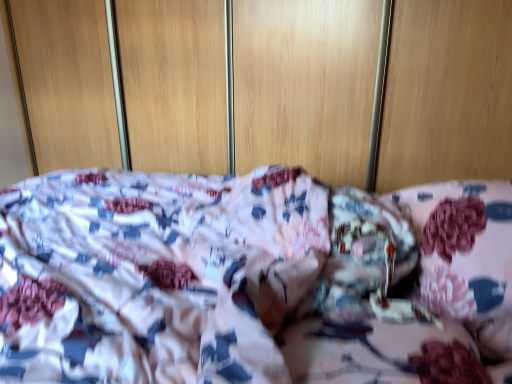
Question: Is wooden dresser at center bigger than fluffy pink pillow at right?

Choices:
 (A) yes
 (B) no

Answer: (A)

Question: Is fluffy pink pillow at right completely or partially inside wooden dresser at center?

Choices:
 (A) yes
 (B) no

Answer: (B)

Question: Does wooden dresser at center have a lesser width compared to fluffy pink pillow at right?

Choices:
 (A) yes
 (B) no

Answer: (A)

Question: Is wooden dresser at center closer to camera compared to fluffy pink pillow at right?

Choices:
 (A) no
 (B) yes

Answer: (A)

Question: From a real-world perspective, is wooden dresser at center on top of fluffy pink pillow at right?

Choices:
 (A) no
 (B) yes

Answer: (B)

Question: Does wooden dresser at center have a lesser height compared to fluffy pink pillow at right?

Choices:
 (A) yes
 (B) no

Answer: (B)

Question: From the image's perspective, is fluffy pink pillow at right located beneath wooden dresser at center?

Choices:
 (A) yes
 (B) no

Answer: (A)

Question: From a real-world perspective, does fluffy pink pillow at right stand above wooden dresser at center?

Choices:
 (A) no
 (B) yes

Answer: (A)

Question: Could you tell me if fluffy pink pillow at right is facing wooden dresser at center?

Choices:
 (A) yes
 (B) no

Answer: (B)

Question: Could wooden dresser at center be considered to be inside fluffy pink pillow at right?

Choices:
 (A) no
 (B) yes

Answer: (A)

Question: Does fluffy pink pillow at right have a smaller size compared to wooden dresser at center?

Choices:
 (A) yes
 (B) no

Answer: (A)

Question: Does fluffy pink pillow at right have a greater height compared to wooden dresser at center?

Choices:
 (A) no
 (B) yes

Answer: (A)

Question: Does point (495, 263) appear closer or farther from the camera than point (303, 74)?

Choices:
 (A) farther
 (B) closer

Answer: (B)